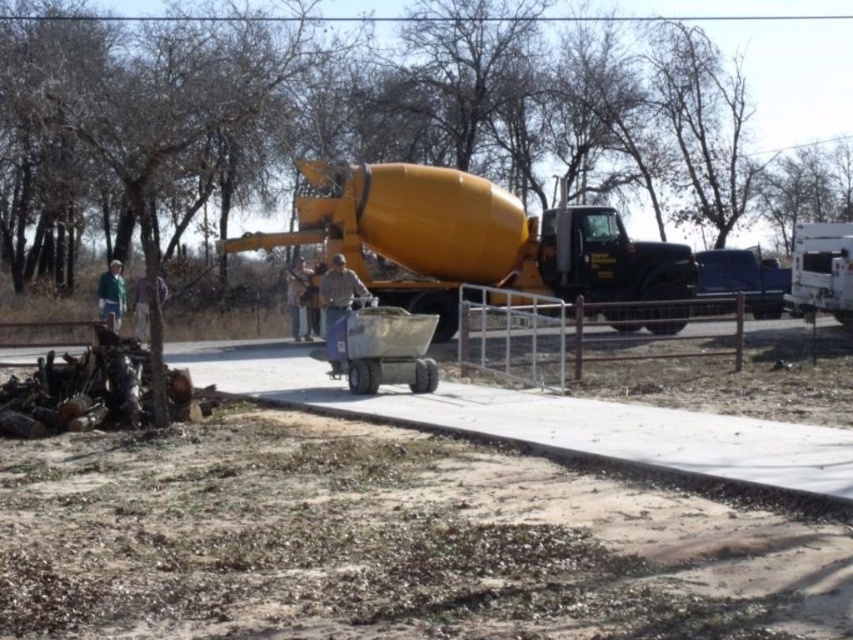
Between camouflage jacket at center and tan fabric shirt at center, which one appears on the left side from the viewer's perspective?

tan fabric shirt at center is more to the left.

Is point (352, 289) in front of point (297, 257)?

Yes.

Does point (326, 276) lie behind point (294, 310)?

That is False.

You are a GUI agent. You are given a task and a screenshot of the screen. Output one action in this format:
    pyautogui.click(x=<x>, y=<y>)
    Task: Click on the camouflage jacket at center
    This screenshot has width=853, height=640.
    Given the screenshot: What is the action you would take?
    pyautogui.click(x=338, y=291)

Looking at this image, is tan fabric shirt at center wider than dark gray fabric jacket at center?

In fact, tan fabric shirt at center might be narrower than dark gray fabric jacket at center.

I want to click on tan fabric shirt at center, so click(x=297, y=298).

Where is `tan fabric shirt at center`? The width and height of the screenshot is (853, 640). tan fabric shirt at center is located at coordinates (297, 298).

Is yellow matte concrete mixer at center above white glossy trailer truck at right?

Yes, yellow matte concrete mixer at center is above white glossy trailer truck at right.

Who is lower down, yellow matte concrete mixer at center or white glossy trailer truck at right?

Positioned lower is white glossy trailer truck at right.

Identify the location of yellow matte concrete mixer at center. (469, 240).

Identify the location of yellow matte concrete mixer at center. The image size is (853, 640). (469, 240).